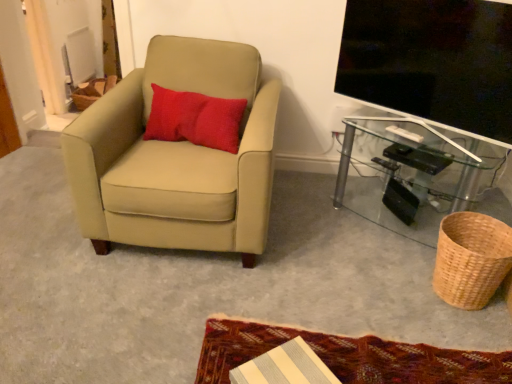
Locate an element on the screen. The width and height of the screenshot is (512, 384). unoccupied region to the right of suede beige armchair at left is located at coordinates (326, 235).